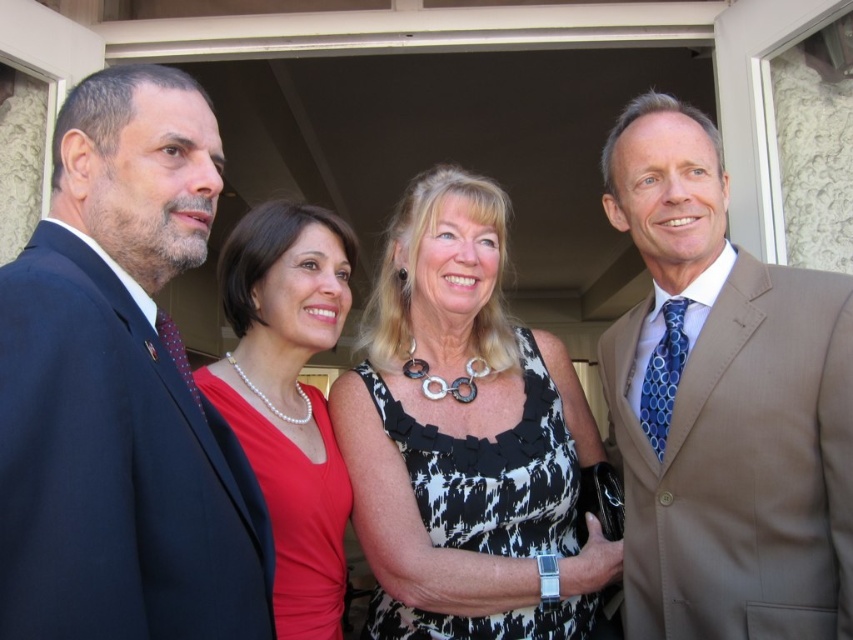
Between light brown suit at right and pearl necklace at center, which one is positioned higher?

Positioned higher is light brown suit at right.

From the picture: Does light brown suit at right have a larger size compared to pearl necklace at center?

Actually, light brown suit at right might be smaller than pearl necklace at center.

You are a GUI agent. You are given a task and a screenshot of the screen. Output one action in this format:
    pyautogui.click(x=<x>, y=<y>)
    Task: Click on the light brown suit at right
    The width and height of the screenshot is (853, 640).
    Given the screenshot: What is the action you would take?
    pyautogui.click(x=723, y=406)

Between dark blue suit at left and pearl necklace at center, which one has less height?

With less height is dark blue suit at left.

Does point (149, 272) lie in front of point (303, 214)?

Yes, point (149, 272) is closer to viewer.

Between point (158, 125) and point (306, 298), which one is positioned in front?

Point (158, 125) is more forward.

I want to click on dark blue suit at left, so click(120, 390).

Which is more to the right, black and white printed dress at center or pearl necklace at center?

Positioned to the right is black and white printed dress at center.

Between point (462, 449) and point (312, 218), which one is positioned behind?

The point (312, 218) is more distant.

Where is `black and white printed dress at center`? The height and width of the screenshot is (640, 853). black and white printed dress at center is located at coordinates (466, 438).